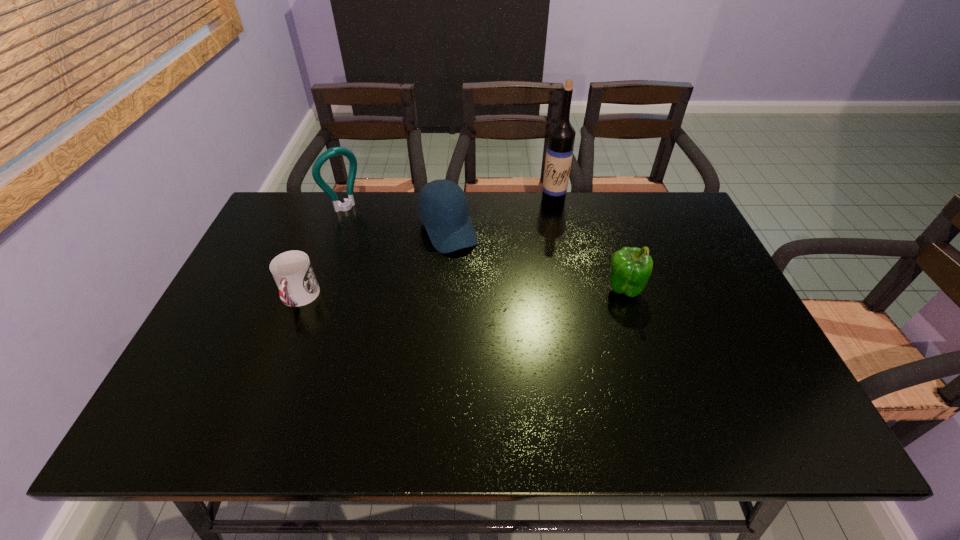
Find the location of a particular element. free area in between the second tallest object and the shortest object is located at coordinates (323, 253).

This screenshot has height=540, width=960. Find the location of `vacant space that's between the shortest object and the fourth shortest object`. vacant space that's between the shortest object and the fourth shortest object is located at coordinates (323, 253).

Locate an element on the screen. vacant area that lies between the baseball cap and the cup is located at coordinates (x=373, y=264).

Locate an element on the screen. blank region between the wine bottle and the bell pepper is located at coordinates (588, 245).

I want to click on free space between the cup and the third object from left to right, so (x=373, y=264).

Identify the location of empty space between the rightmost object and the shortest object. The image size is (960, 540). (462, 294).

Identify which object is the nearest to the bottle opener. Please provide its 2D coordinates. Your answer should be formatted as a tuple, i.e. [(x, y)], where the tuple contains the x and y coordinates of a point satisfying the conditions above.

[(442, 206)]

Locate which object ranks fourth in proximity to the bell pepper. Please provide its 2D coordinates. Your answer should be formatted as a tuple, i.e. [(x, y)], where the tuple contains the x and y coordinates of a point satisfying the conditions above.

[(348, 203)]

At what (x,y) coordinates should I click in order to perform the action: click on vacant space that satisfies the following two spatial constraints: 1. on the front side of the third shortest object; 2. on the left side of the tallest object. Please return your answer as a coordinate pair (x, y). Looking at the image, I should click on (571, 289).

This screenshot has width=960, height=540. In order to click on free point that satisfies the following two spatial constraints: 1. on the front side of the bell pepper; 2. on the right side of the fourth shortest object in this screenshot , I will do `click(316, 289)`.